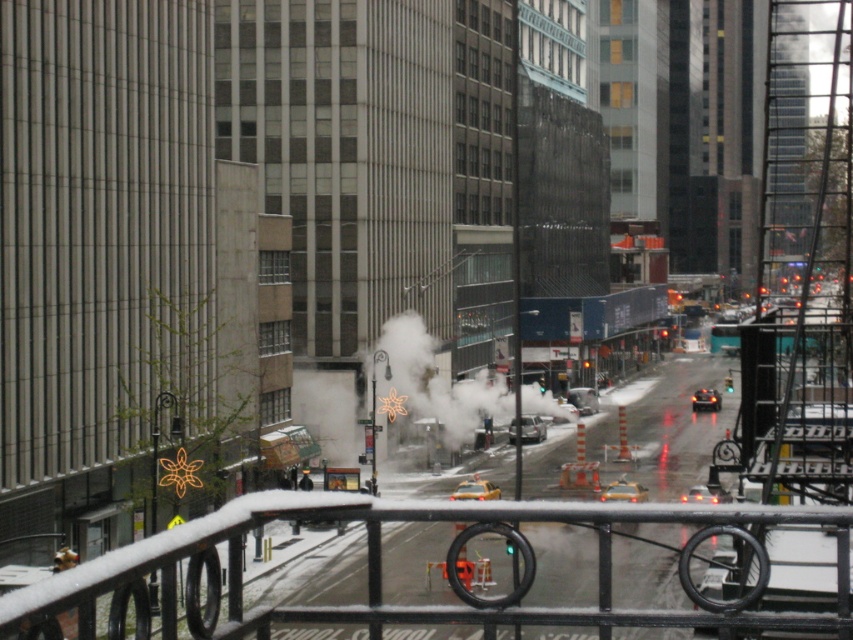
Which is behind, point (543, 428) or point (701, 400)?

The point (701, 400) is behind.

The image size is (853, 640). What do you see at coordinates (532, 428) in the screenshot?
I see `silver metallic sedan at center` at bounding box center [532, 428].

Locate an element on the screen. This screenshot has width=853, height=640. silver metallic sedan at center is located at coordinates (532, 428).